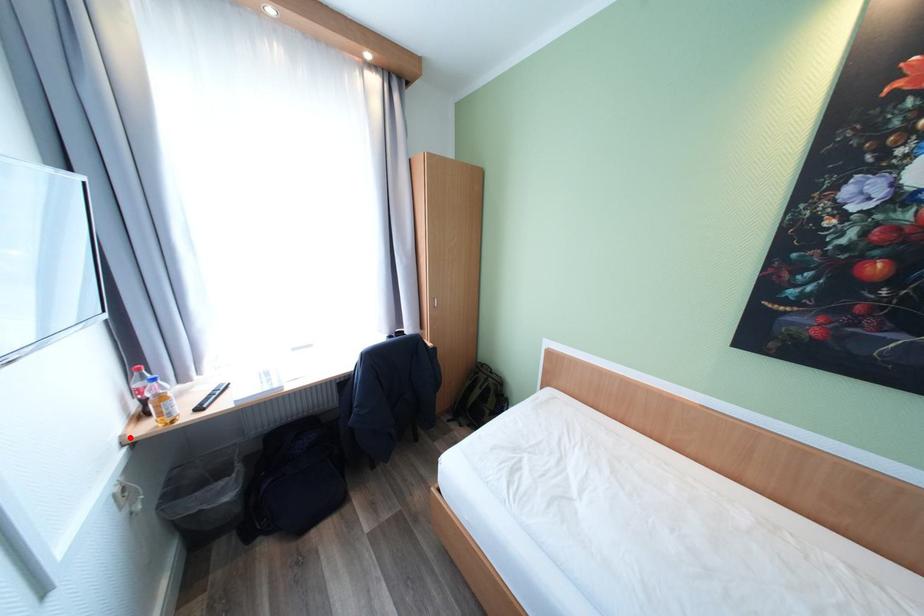
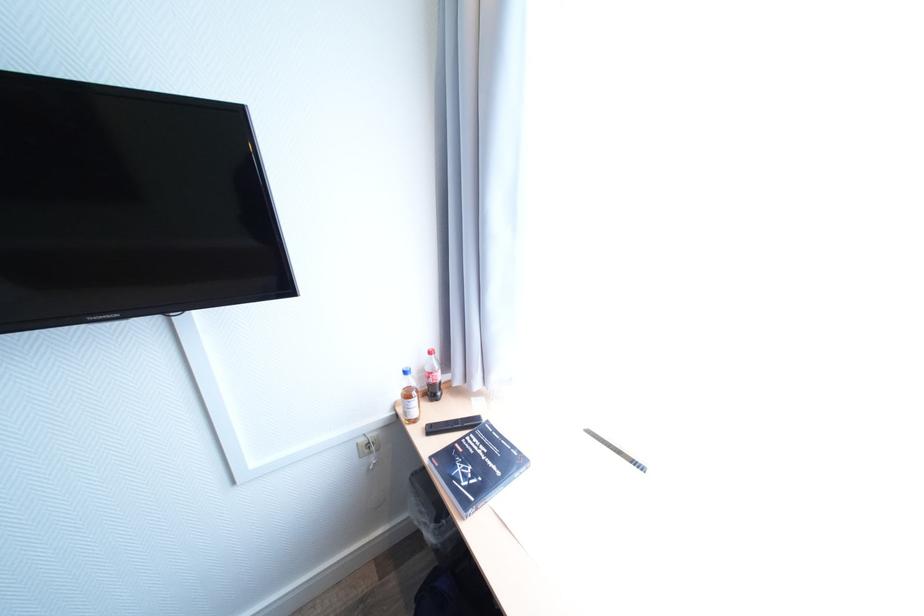
Where in the second image is the point corresponding to the highlighted location from the first image?

(403, 403)